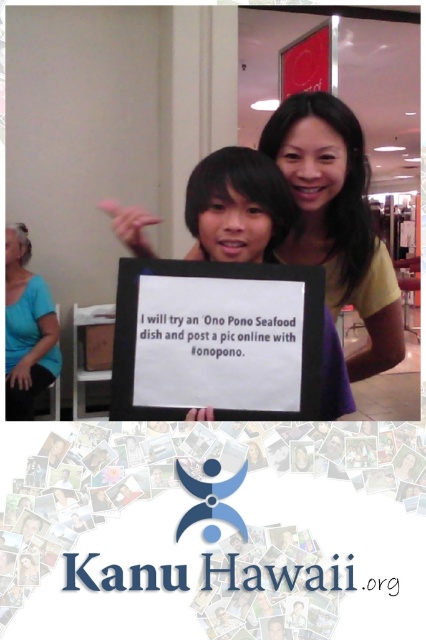
Which is more to the left, white paper sign at center or blue fabric shirt at left?

blue fabric shirt at left

Is white paper sign at center behind blue fabric shirt at left?

No, it is in front of blue fabric shirt at left.

Where is `white paper sign at center`? This screenshot has width=426, height=640. white paper sign at center is located at coordinates (238, 205).

Image resolution: width=426 pixels, height=640 pixels. I want to click on white paper sign at center, so 238,205.